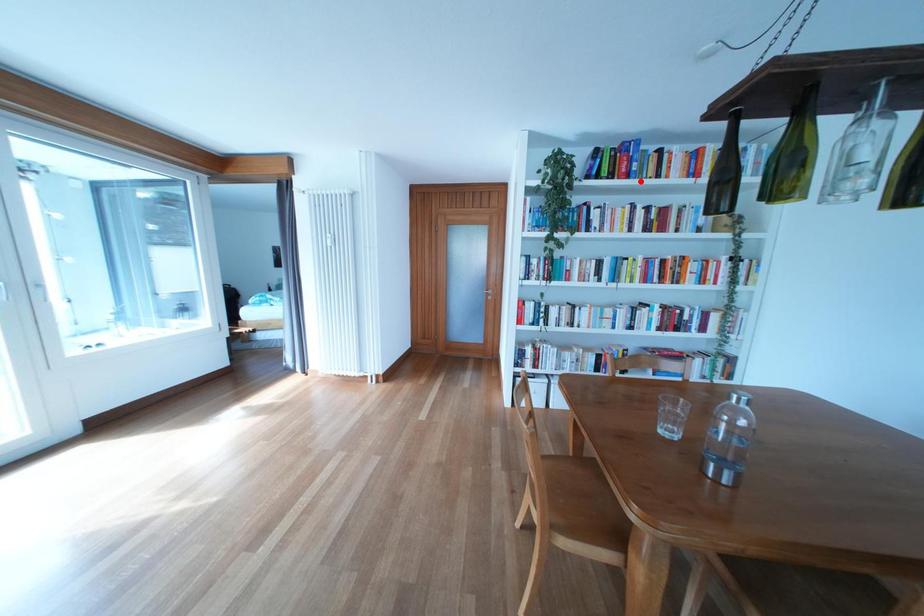
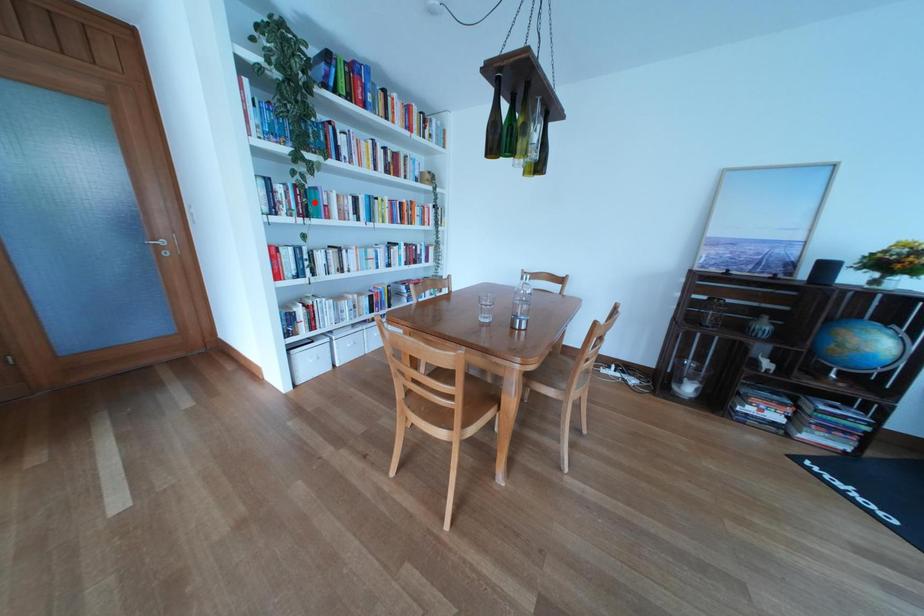
I am providing you with two images of the same scene from different viewpoints. A red point is marked on the first image and another point is marked on the second image. Do the highlighted points in image1 and image2 indicate the same real-world spot?

No